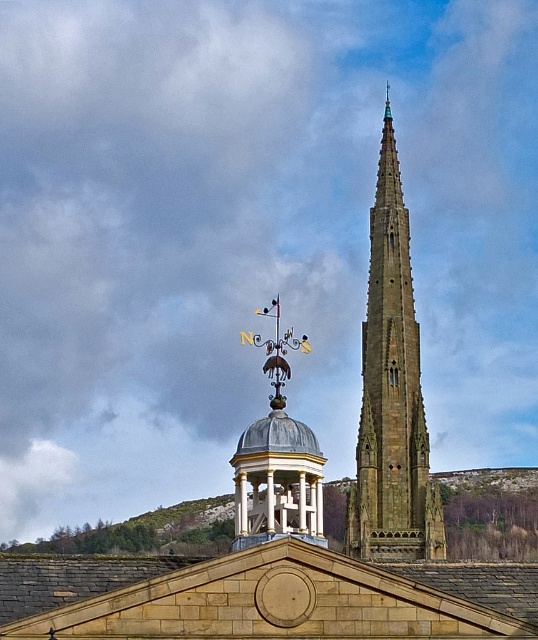
Which is below, brown stone spire at center or metallic dome at center?

metallic dome at center is lower down.

Is point (400, 396) farther from viewer compared to point (294, 429)?

Yes, it is.

The height and width of the screenshot is (640, 538). In order to click on brown stone spire at center in this screenshot , I will do `click(392, 394)`.

Measure the distance between point (279, 593) and camera.

Point (279, 593) and camera are 204.41 feet apart from each other.

Does brown stone roof at center have a smaller size compared to brown stone spire at center?

Yes.

Who is more distant from viewer, (332, 577) or (390, 198)?

Positioned behind is point (390, 198).

Identify the location of brown stone roof at center. This screenshot has width=538, height=640. (265, 596).

What do you see at coordinates (265, 596) in the screenshot? The width and height of the screenshot is (538, 640). I see `brown stone roof at center` at bounding box center [265, 596].

Is brown stone roof at center positioned behind metallic dome at center?

No, brown stone roof at center is closer to the viewer.

Is point (534, 572) positioned behind point (316, 442)?

Yes.

Find the location of a particular element. The width and height of the screenshot is (538, 640). brown stone roof at center is located at coordinates (265, 596).